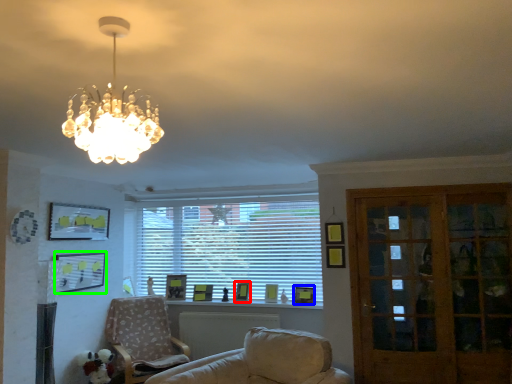
Question: Estimate the real-world distances between objects in this image. Which object is farther from picture frame (highlighted by a red box), picture frame (highlighted by a blue box) or picture frame (highlighted by a green box)?

Choices:
 (A) picture frame
 (B) picture frame

Answer: (B)